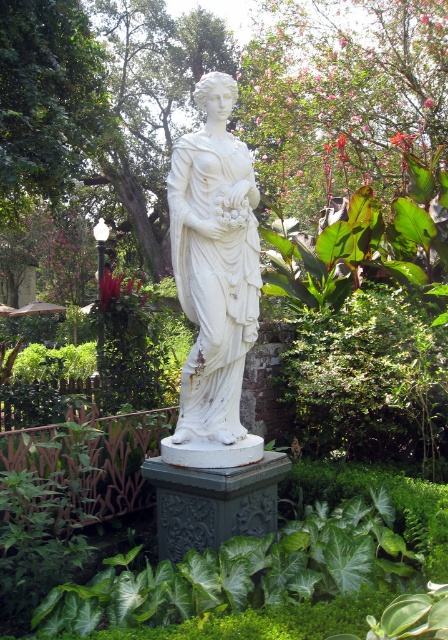
You are a photographer standing in front of the classical white statue. You want to take a photo that includes both the statue and the pedestal. However, you notice two points marked in the scene. The first point is at coordinate point (4, 132), and the second is at point (202, 273). Which of these points is closer to your camera lens?

Point (4, 132) is further to the camera than point (202, 273). Therefore, point (202, 273) is closer to the camera lens.

You are a gardener who wants to water the white marble statue at center. You have a watering can that can spray water up to 2 meters. The green leafy tree at center has branches that extend 1.5 meters above the statue. Can you water the statue without getting the tree wet?

The green leafy tree at center is positioned over the white marble statue at center, and its branches extend 1.5 meters above the statue. Since the watering can can spray up to 2 meters, you can water the statue without getting the tree wet as the branches are only 1.5 meters above the statue, which is within the watering can range but the tree is above the statue, so water can be directed below the branches.

Based on the photo, you are a gardener planning to water the green leafy tree at center and the white marble statue at center. You have a hose that can reach up to 8 meters. Can you water both objects without moving the hose? Please explain your reasoning.

The green leafy tree at center and the white marble statue at center are 7.84 meters apart from each other. Since the hose can reach up to 8 meters, which is longer than the distance between them, you can water both objects without moving the hose as the distance is within the hose length capacity.